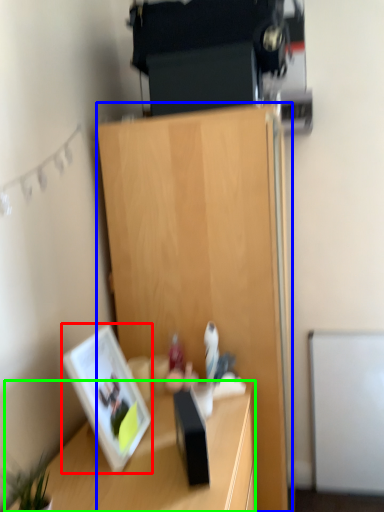
Question: Based on their relative distances, which object is farther from picture frame (highlighted by a red box)? Choose from cabinetry (highlighted by a blue box) and desk (highlighted by a green box).

Choices:
 (A) cabinetry
 (B) desk

Answer: (A)